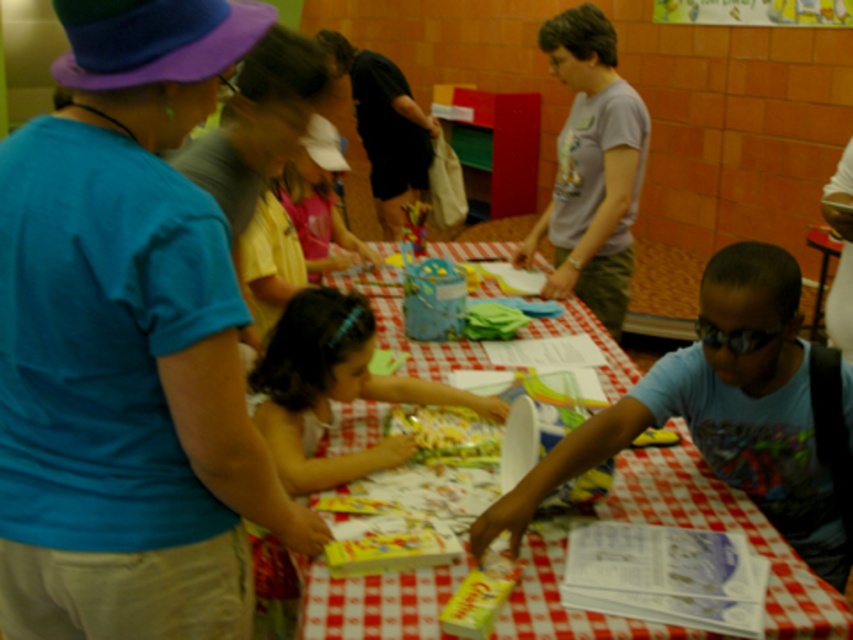
You are standing at the back of the room and want to see the checkered fabric table at center. Is the blue cotton shirt at left blocking your view of it?

The blue cotton shirt at left is located above the checkered fabric table at center, so it is blocking your view of the table.